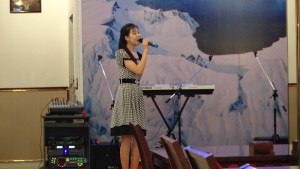
Find the location of a particular element. This screenshot has height=169, width=300. blue wall is located at coordinates (233, 24).